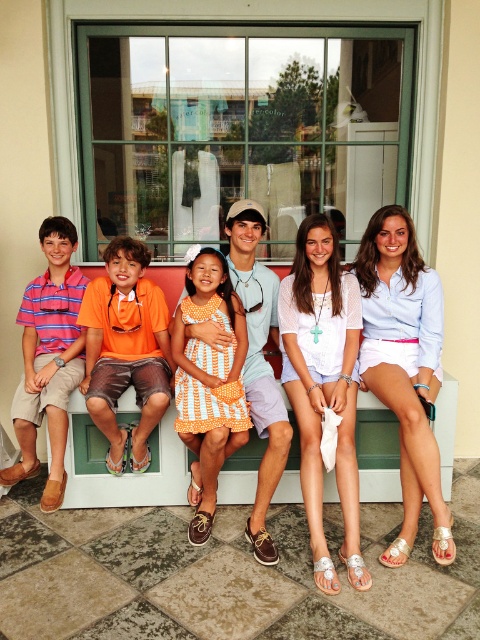
Question: Estimate the real-world distances between objects in this image. Which object is farther from the light blue cotton shirt at center?

Choices:
 (A) striped cotton polo shirt at left
 (B) white cotton dress at center
 (C) orange fabric shorts at left

Answer: (A)

Question: Does white cotton dress at center have a lesser width compared to orange polka dot dress at center?

Choices:
 (A) yes
 (B) no

Answer: (B)

Question: Observing the image, what is the correct spatial positioning of orange polka dot dress at center in reference to striped cotton polo shirt at left?

Choices:
 (A) above
 (B) below

Answer: (B)

Question: Does orange fabric shorts at left lie in front of orange polka dot dress at center?

Choices:
 (A) yes
 (B) no

Answer: (B)

Question: Which object appears farthest from the camera in this image?

Choices:
 (A) striped cotton polo shirt at left
 (B) white cotton dress at center
 (C) white lace top at center

Answer: (B)

Question: Which of the following is the closest to the observer?

Choices:
 (A) (97, 353)
 (B) (238, 342)
 (C) (135, 504)

Answer: (B)